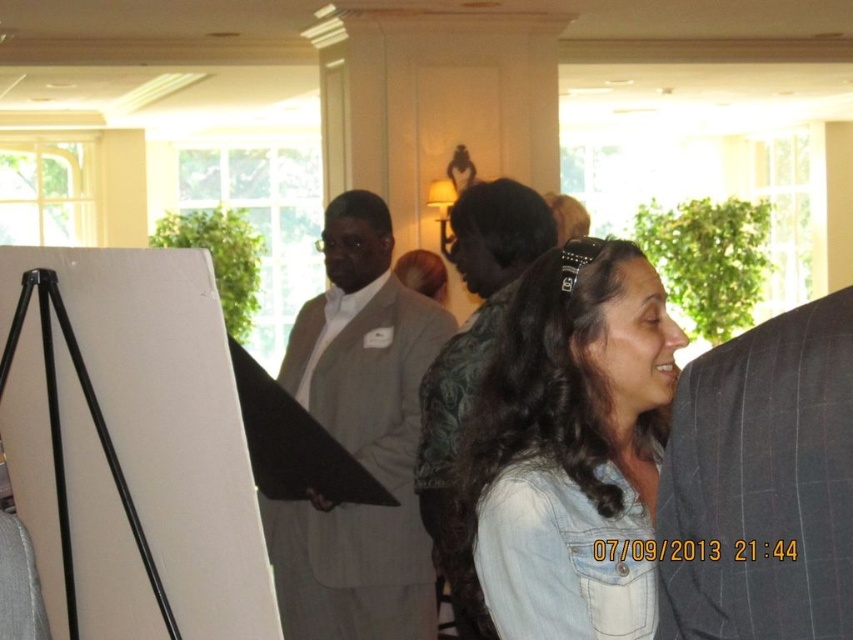
Question: Which of the following is the farthest from the observer?

Choices:
 (A) (514, 180)
 (B) (755, 499)
 (C) (83, 344)

Answer: (A)

Question: Which of the following is the closest to the observer?

Choices:
 (A) dark gray pinstripe suit at right
 (B) denim shirt at center

Answer: (A)

Question: Can you confirm if denim shirt at center is thinner than dark gray suit at center?

Choices:
 (A) no
 (B) yes

Answer: (B)

Question: Considering the real-world distances, which object is farthest from the black matte easel at left?

Choices:
 (A) dark gray suit at center
 (B) dark gray pinstripe suit at right
 (C) gray suit at center

Answer: (C)

Question: From the image, what is the correct spatial relationship of denim shirt at center in relation to dark gray suit at center?

Choices:
 (A) below
 (B) above

Answer: (A)

Question: Can you confirm if denim shirt at center is smaller than dark gray pinstripe suit at right?

Choices:
 (A) yes
 (B) no

Answer: (B)